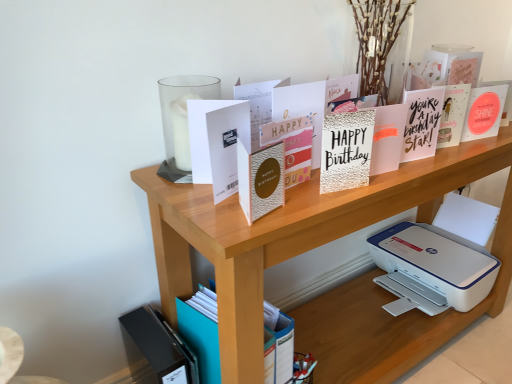
This screenshot has height=384, width=512. Describe the element at coordinates (447, 72) in the screenshot. I see `metallic gold card at upper center` at that location.

Locate an element on the screen. The height and width of the screenshot is (384, 512). matte white card at upper right, the first paperback book when ordered from right to left is located at coordinates (484, 112).

Where is `matte gold card at center, which appears as the 3th paperback book when viewed from the left`? matte gold card at center, which appears as the 3th paperback book when viewed from the left is located at coordinates (261, 179).

Measure the distance between wooden shelf at upper center and camera.

A distance of 28.65 inches exists between wooden shelf at upper center and camera.

Identify the location of metallic gold card at upper center. (447, 72).

Who is taller, black matte journal at lower left or matte gold card at center, the fifth paperback book when ordered from left to right?

Standing taller between the two is black matte journal at lower left.

At what (x,y) coordinates should I click in order to perform the action: click on the 3rd paperback book in front of the black matte journal at lower left. Please return your answer as a coordinate pair (x, y). The image size is (512, 384). Looking at the image, I should click on (302, 109).

How different are the orientations of black matte journal at lower left and matte gold card at center, the 4th paperback book positioned from the right, in degrees?

There is a 1.37-degree angle between the facing directions of black matte journal at lower left and matte gold card at center, the 4th paperback book positioned from the right.

From the image's perspective, is black matte journal at lower left located beneath matte gold card at center, the fifth paperback book when ordered from left to right?

Yes, from the image's perspective, black matte journal at lower left is beneath matte gold card at center, the fifth paperback book when ordered from left to right.

Looking at their sizes, would you say silver glitter card at center, the 3th paperback book viewed from the right, is wider or thinner than matte gold card at center, the 4th paperback book positioned from the right?

Clearly, silver glitter card at center, the 3th paperback book viewed from the right, has more width compared to matte gold card at center, the 4th paperback book positioned from the right.

Who is taller, silver glitter card at center, the 6th paperback book when ordered from left to right, or matte gold card at center, the fifth paperback book when ordered from left to right?

matte gold card at center, the fifth paperback book when ordered from left to right.

From a real-world perspective, is silver glitter card at center, the 6th paperback book when ordered from left to right, positioned above or below matte gold card at center, the 4th paperback book positioned from the right?

silver glitter card at center, the 6th paperback book when ordered from left to right, is situated lower than matte gold card at center, the 4th paperback book positioned from the right, in the real world.

Where is `paperback book that is the 2nd one when counting downward from the matte gold card at center, the fifth paperback book when ordered from left to right (from the image's perspective)`? Image resolution: width=512 pixels, height=384 pixels. paperback book that is the 2nd one when counting downward from the matte gold card at center, the fifth paperback book when ordered from left to right (from the image's perspective) is located at coordinates (346, 150).

Which is in front, point (198, 102) or point (495, 111)?

Positioned in front is point (198, 102).

Which object is wider, white matte card at upper center, acting as the 8th paperback book starting from the right, or matte white card at upper right, which appears as the 8th paperback book when viewed from the left?

matte white card at upper right, which appears as the 8th paperback book when viewed from the left.

Considering their positions, is white matte card at upper center, acting as the 8th paperback book starting from the right, located in front of or behind matte white card at upper right, the first paperback book when ordered from right to left?

Clearly, white matte card at upper center, acting as the 8th paperback book starting from the right, is in front of matte white card at upper right, the first paperback book when ordered from right to left.

From a real-world perspective, is white matte card at upper center, which is counted as the 1th paperback book, starting from the left, located higher than matte white card at upper right, the first paperback book when ordered from right to left?

Yes, from a real-world perspective, white matte card at upper center, which is counted as the 1th paperback book, starting from the left, is above matte white card at upper right, the first paperback book when ordered from right to left.

Between point (164, 349) and point (351, 174), which one is positioned behind?

Point (164, 349)

From a real-world perspective, is black matte journal at lower left positioned under silver glitter card at center, the 3th paperback book viewed from the right, based on gravity?

Correct, in the physical world, black matte journal at lower left is lower than silver glitter card at center, the 3th paperback book viewed from the right.

Which is more to the left, black matte journal at lower left or silver glitter card at center, the 3th paperback book viewed from the right?

black matte journal at lower left.

Does black matte journal at lower left turn towards silver glitter card at center, the 6th paperback book when ordered from left to right?

No, black matte journal at lower left does not turn towards silver glitter card at center, the 6th paperback book when ordered from left to right.

In the scene shown: Is metallic gold card at upper center positioned with its back to matte gold card at center, which appears as the 3th paperback book when viewed from the left?

That's not correct — metallic gold card at upper center is not looking away from matte gold card at center, which appears as the 3th paperback book when viewed from the left.

Does metallic gold card at upper center appear on the left side of matte gold card at center, which is the 6th paperback book in right-to-left order?

Incorrect, metallic gold card at upper center is not on the left side of matte gold card at center, which is the 6th paperback book in right-to-left order.

Is metallic gold card at upper center not close to matte gold card at center, which is the 6th paperback book in right-to-left order?

No, metallic gold card at upper center is in close proximity to matte gold card at center, which is the 6th paperback book in right-to-left order.

You are a GUI agent. You are given a task and a screenshot of the screen. Output one action in this format:
    pyautogui.click(x=<x>, y=<y>)
    Task: Click on the 8th paperback book below the metallic gold card at upper center (from the image's perspective)
    The height and width of the screenshot is (384, 512).
    Given the screenshot: What is the action you would take?
    pyautogui.click(x=261, y=179)

Based on the photo, are matte white card at upper right, the first paperback book when ordered from right to left, and gold textured card at center, which ranks as the fifth paperback book in right-to-left order, located far from each other?

That's not correct — matte white card at upper right, the first paperback book when ordered from right to left, is a little close to gold textured card at center, which ranks as the fifth paperback book in right-to-left order.

Is matte white card at upper right, which appears as the 8th paperback book when viewed from the left, facing towards gold textured card at center, which ranks as the fifth paperback book in right-to-left order?

No, matte white card at upper right, which appears as the 8th paperback book when viewed from the left, is not oriented towards gold textured card at center, which ranks as the fifth paperback book in right-to-left order.

There is a gold textured card at center, which ranks as the fifth paperback book in right-to-left order. Identify the location of the 1st paperback book below it (from a real-world perspective). (484, 112).

Considering the sizes of objects matte white card at upper right, the first paperback book when ordered from right to left, and gold textured card at center, which ranks as the fifth paperback book in right-to-left order, in the image provided, who is smaller, matte white card at upper right, the first paperback book when ordered from right to left, or gold textured card at center, which ranks as the fifth paperback book in right-to-left order,?

Smaller between the two is gold textured card at center, which ranks as the fifth paperback book in right-to-left order.

Is silver glitter card at center, the 6th paperback book when ordered from left to right, smaller than white matte card at center, acting as the 7th paperback book starting from the right?

Indeed, silver glitter card at center, the 6th paperback book when ordered from left to right, has a smaller size compared to white matte card at center, acting as the 7th paperback book starting from the right.

At what (x,y) coordinates should I click in order to perform the action: click on paperback book that is the 3rd object located behind the silver glitter card at center, the 3th paperback book viewed from the right. Please return your answer as a coordinate pair (x, y). The height and width of the screenshot is (384, 512). Looking at the image, I should click on (258, 104).

How far apart are silver glitter card at center, the 3th paperback book viewed from the right, and white matte card at center, acting as the 7th paperback book starting from the right?

silver glitter card at center, the 3th paperback book viewed from the right, is 7.51 inches away from white matte card at center, acting as the 7th paperback book starting from the right.

This screenshot has height=384, width=512. Identify the location of journal that is under the matte gold card at center, the 4th paperback book positioned from the right (from a real-world perspective). (158, 345).

From a real-world perspective, count 3rd paperback books upward from the silver glitter card at center, the 3th paperback book viewed from the right, and point to it. Please provide its 2D coordinates.

[(302, 109)]

Considering their positions, is matte gold card at center, which appears as the 3th paperback book when viewed from the left, positioned closer to white textured card at center, which is counted as the seventh paperback book, starting from the left, than gold textured card at center, which ranks as the fifth paperback book in right-to-left order?

gold textured card at center, which ranks as the fifth paperback book in right-to-left order, is positioned closer to the anchor white textured card at center, which is counted as the seventh paperback book, starting from the left.

Estimate the real-world distances between objects in this image. Which object is further from wooden shelf at upper center, gold textured card at center, the 4th paperback book in the left-to-right sequence, or white matte card at center, acting as the 7th paperback book starting from the right?

white matte card at center, acting as the 7th paperback book starting from the right, lies further to wooden shelf at upper center than the other object.

Considering their positions, is wooden shelf at upper center positioned further to gold textured card at center, which ranks as the fifth paperback book in right-to-left order, than white matte card at upper center, acting as the 8th paperback book starting from the right?

wooden shelf at upper center.

Looking at the image, which one is located closer to matte gold card at center, the fifth paperback book when ordered from left to right, black matte journal at lower left or metallic gold card at upper center?

Among the two, metallic gold card at upper center is located nearer to matte gold card at center, the fifth paperback book when ordered from left to right.

Looking at the image, which one is located further to wooden shelf at upper center, metallic gold card at upper center or matte gold card at center, the fifth paperback book when ordered from left to right?

matte gold card at center, the fifth paperback book when ordered from left to right, is positioned further to the anchor wooden shelf at upper center.

In the scene shown: When comparing their distances from silver glitter card at center, the 3th paperback book viewed from the right, does matte white card at upper right, the first paperback book when ordered from right to left, or wooden shelf at upper center seem further?

Based on the image, matte white card at upper right, the first paperback book when ordered from right to left, appears to be further to silver glitter card at center, the 3th paperback book viewed from the right.

Looking at the image, which one is located further to white textured card at center, the 2th paperback book viewed from the right, wooden shelf at upper center or white matte card at center, acting as the 7th paperback book starting from the right?

white matte card at center, acting as the 7th paperback book starting from the right, lies further to white textured card at center, the 2th paperback book viewed from the right, than the other object.

Considering their positions, is matte gold card at center, the 4th paperback book positioned from the right, positioned closer to matte white card at upper right, which appears as the 8th paperback book when viewed from the left, than black matte journal at lower left?

The object closer to matte white card at upper right, which appears as the 8th paperback book when viewed from the left, is matte gold card at center, the 4th paperback book positioned from the right.

Where is `book between gold textured card at center, which ranks as the fifth paperback book in right-to-left order, and matte white card at upper right, which appears as the 8th paperback book when viewed from the left, in the horizontal direction`? This screenshot has width=512, height=384. book between gold textured card at center, which ranks as the fifth paperback book in right-to-left order, and matte white card at upper right, which appears as the 8th paperback book when viewed from the left, in the horizontal direction is located at coordinates (447, 72).

Find the location of a particular element. paperback book situated between silver glitter card at center, the 6th paperback book when ordered from left to right, and matte white card at upper right, the first paperback book when ordered from right to left, from left to right is located at coordinates (388, 138).

At what (x,y) coordinates should I click in order to perform the action: click on book between matte gold card at center, the fifth paperback book when ordered from left to right, and matte white card at upper right, the first paperback book when ordered from right to left, in the horizontal direction. Please return your answer as a coordinate pair (x, y). Looking at the image, I should click on (447, 72).

I want to click on shelf between black matte journal at lower left and matte white card at upper right, the first paperback book when ordered from right to left, from left to right, so click(x=287, y=234).